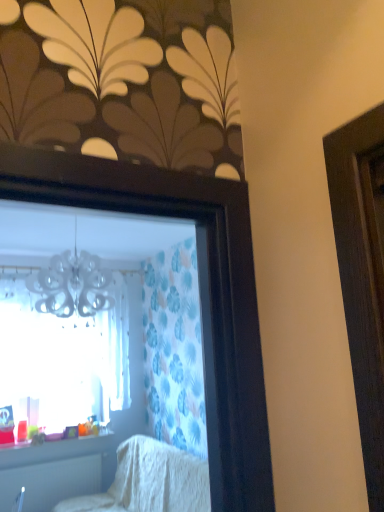
Question: Can we say white textured blanket at lower center lies outside translucent plastic cups at lower left?

Choices:
 (A) yes
 (B) no

Answer: (A)

Question: Considering the relative sizes of white textured blanket at lower center and translucent plastic cups at lower left in the image provided, is white textured blanket at lower center thinner than translucent plastic cups at lower left?

Choices:
 (A) yes
 (B) no

Answer: (B)

Question: Does white textured blanket at lower center have a greater width compared to translucent plastic cups at lower left?

Choices:
 (A) yes
 (B) no

Answer: (A)

Question: Is white textured blanket at lower center aimed at translucent plastic cups at lower left?

Choices:
 (A) no
 (B) yes

Answer: (A)

Question: Is white textured blanket at lower center not near translucent plastic cups at lower left?

Choices:
 (A) yes
 (B) no

Answer: (B)

Question: Is white textured blanket at lower center turned away from translucent plastic cups at lower left?

Choices:
 (A) no
 (B) yes

Answer: (A)

Question: From a real-world perspective, is white textured blanket at lower center positioned under white plastic radiator at lower left based on gravity?

Choices:
 (A) yes
 (B) no

Answer: (B)

Question: Is white textured blanket at lower center closer to the viewer compared to white plastic radiator at lower left?

Choices:
 (A) yes
 (B) no

Answer: (A)

Question: Considering the relative sizes of white textured blanket at lower center and white plastic radiator at lower left in the image provided, is white textured blanket at lower center shorter than white plastic radiator at lower left?

Choices:
 (A) yes
 (B) no

Answer: (B)

Question: Can you confirm if white textured blanket at lower center is thinner than white plastic radiator at lower left?

Choices:
 (A) no
 (B) yes

Answer: (A)

Question: From a real-world perspective, is white textured blanket at lower center on white plastic radiator at lower left?

Choices:
 (A) yes
 (B) no

Answer: (A)

Question: From the image's perspective, is white textured blanket at lower center located above white plastic radiator at lower left?

Choices:
 (A) no
 (B) yes

Answer: (B)

Question: From a real-world perspective, is white plastic radiator at lower left positioned under white textured blanket at lower center based on gravity?

Choices:
 (A) yes
 (B) no

Answer: (A)